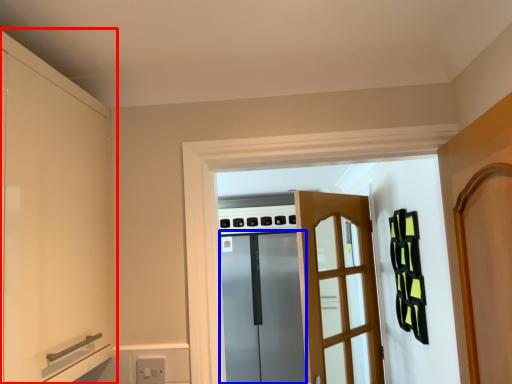
Question: Among these objects, which one is nearest to the camera, cabinetry (highlighted by a red box) or screen door (highlighted by a blue box)?

Choices:
 (A) cabinetry
 (B) screen door

Answer: (A)